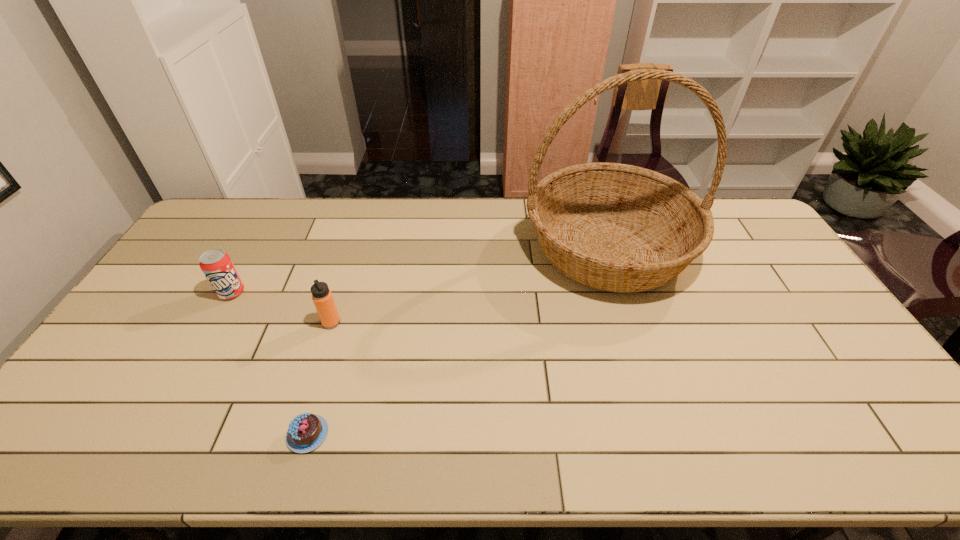
Where is `unoccupied position between the second nearest object and the basket`? This screenshot has width=960, height=540. unoccupied position between the second nearest object and the basket is located at coordinates (469, 285).

Identify the location of vacant area that lies between the thermos bottle and the tallest object. The width and height of the screenshot is (960, 540). (469, 285).

Identify the location of free spot between the shortest object and the second nearest object. (320, 379).

The height and width of the screenshot is (540, 960). In order to click on free space between the chocolate cake and the leftmost object in this screenshot , I will do `click(270, 363)`.

Locate an element on the screen. This screenshot has height=540, width=960. vacant space that's between the shortest object and the rightmost object is located at coordinates (458, 341).

Find the location of a particular element. This screenshot has width=960, height=540. object that is the second closest to the chocolate cake is located at coordinates (217, 266).

Identify which object is the closest to the soda can. Please provide its 2D coordinates. Your answer should be formatted as a tuple, i.e. [(x, y)], where the tuple contains the x and y coordinates of a point satisfying the conditions above.

[(322, 297)]

What are the coordinates of `blank area in the image that satisfies the following two spatial constraints: 1. on the surface of the soda can; 2. on the left side of the shortest object` in the screenshot? It's located at (152, 434).

This screenshot has height=540, width=960. In order to click on vacant region that satisfies the following two spatial constraints: 1. on the front side of the third farthest object; 2. on the right side of the nearest object in this screenshot , I will do `click(296, 434)`.

The width and height of the screenshot is (960, 540). Identify the location of vacant space that satisfies the following two spatial constraints: 1. on the surface of the thermos bottle; 2. on the left side of the soda can. (214, 322).